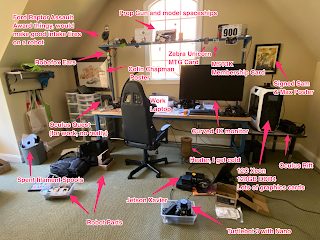
You are a GUI agent. You are given a task and a screenshot of the screen. Output one action in this format:
    pyautogui.click(x=<x>, y=<y>)
    Task: Click on the wall picture on right side of desk
    The height and width of the screenshot is (240, 320).
    Given the screenshot: What is the action you would take?
    pyautogui.click(x=266, y=61)